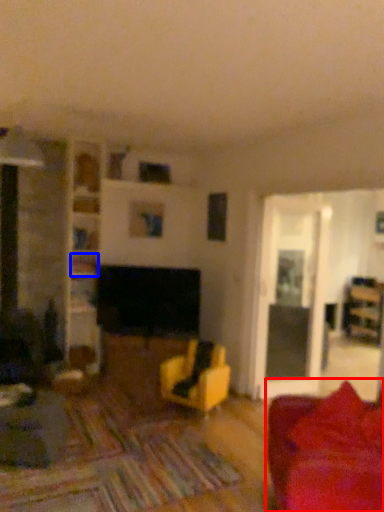
Question: Which object is closer to the camera taking this photo, studio couch (highlighted by a red box) or shelf (highlighted by a blue box)?

Choices:
 (A) studio couch
 (B) shelf

Answer: (A)